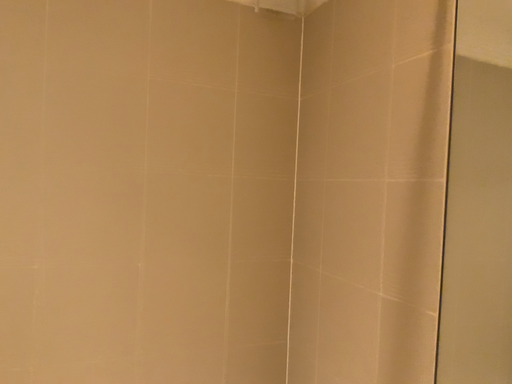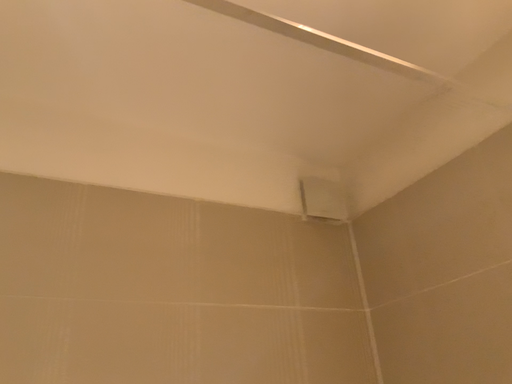
Question: Which way did the camera rotate in the video?

Choices:
 (A) rotated upward
 (B) rotated downward

Answer: (A)